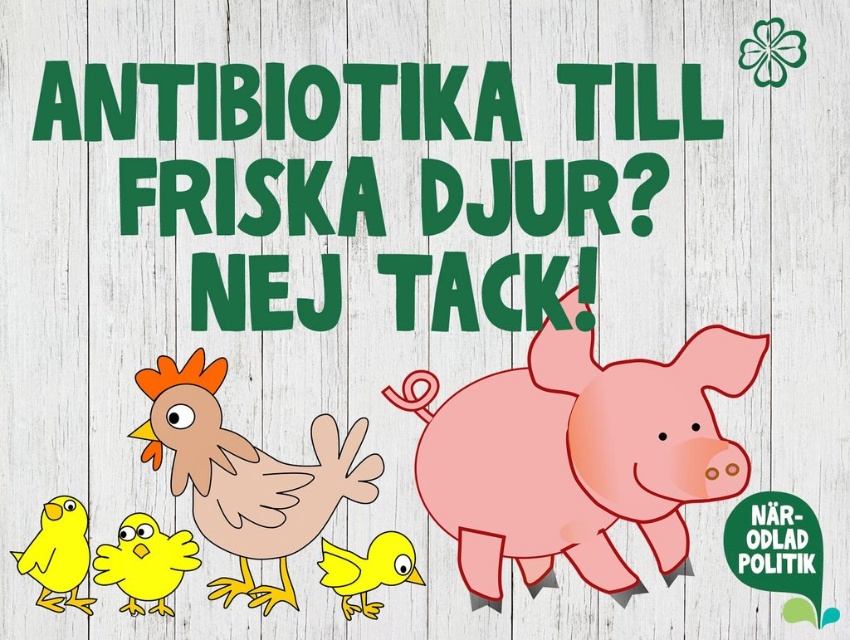
Is pink matte pig at center wider than matte yellow chick at lower left?

Correct, the width of pink matte pig at center exceeds that of matte yellow chick at lower left.

At what (x,y) coordinates should I click in order to perform the action: click on pink matte pig at center. Please return your answer as a coordinate pair (x, y). Looking at the image, I should click on (578, 454).

Consider the image. Who is more distant from viewer, [712,358] or [156,608]?

The point [712,358] is more distant.

Image resolution: width=850 pixels, height=640 pixels. What are the coordinates of `pink matte pig at center` in the screenshot? It's located at (578, 454).

Which is behind, point (88, 605) or point (394, 584)?

Positioned behind is point (394, 584).

Who is lower down, matte yellow bird at lower left or matte yellow bird at center?

matte yellow bird at center is lower down.

Who is more forward, (55, 611) or (340, 550)?

Positioned in front is point (55, 611).

Locate an element on the screen. The width and height of the screenshot is (850, 640). matte yellow bird at lower left is located at coordinates (58, 556).

In the scene shown: Does brown matte chicken at center appear under matte yellow bird at lower left?

No, brown matte chicken at center is not below matte yellow bird at lower left.

Does brown matte chicken at center have a greater width compared to matte yellow bird at lower left?

Indeed, brown matte chicken at center has a greater width compared to matte yellow bird at lower left.

Locate an element on the screen. The height and width of the screenshot is (640, 850). brown matte chicken at center is located at coordinates (246, 474).

At what (x,y) coordinates should I click in order to perform the action: click on brown matte chicken at center. Please return your answer as a coordinate pair (x, y). Looking at the image, I should click on (246, 474).